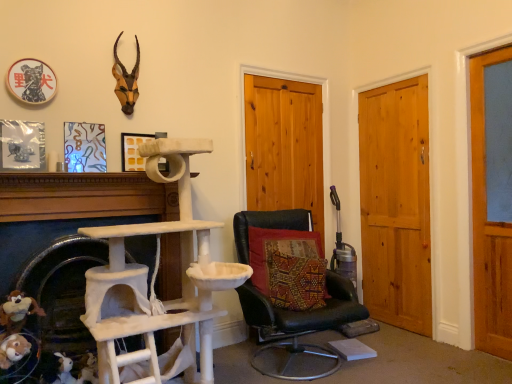
What is the approximate width of natural wood door at center right, the 2th door from the right?

natural wood door at center right, the 2th door from the right, is 3.34 inches in width.

Locate an element on the screen. wooden door at center, which is counted as the third door, starting from the right is located at coordinates (284, 146).

Describe the element at coordinates (288, 267) in the screenshot. I see `textured red cushion at center` at that location.

In order to face wooden door at right, the first door viewed from the right, should I rotate leftwards or rightwards?

To align with it, rotate right about 29.449°.

Locate an element on the screen. This screenshot has width=512, height=384. black leather chair at center is located at coordinates (300, 325).

Where is `natural wood door at center right, marked as the second door in a left-to-right arrangement`? This screenshot has width=512, height=384. natural wood door at center right, marked as the second door in a left-to-right arrangement is located at coordinates (396, 204).

Is brown plush toy at lower left, positioned as the first toy in top-to-bottom order, not close to wooden door at right, the first door viewed from the right?

Absolutely, brown plush toy at lower left, positioned as the first toy in top-to-bottom order, is distant from wooden door at right, the first door viewed from the right.

Considering the positions of point (13, 326) and point (490, 193), is point (13, 326) closer or farther from the camera than point (490, 193)?

Point (13, 326) appears to be closer to the viewer than point (490, 193).

From the image's perspective, between brown plush toy at lower left, positioned as the second toy in back-to-front order, and wooden door at right, the first door viewed from the right, which one is located above?

wooden door at right, the first door viewed from the right, is shown above in the image.

Looking at this image, is wooden door at center, which is counted as the third door, starting from the right, smaller than black leather chair at center?

Yes.

Considering the points (266, 132) and (331, 277), which point is in front, point (266, 132) or point (331, 277)?

The point (331, 277) is more forward.

Does wooden door at center, which is counted as the third door, starting from the right, touch black leather chair at center?

No, wooden door at center, which is counted as the third door, starting from the right, is not touching black leather chair at center.

What's the angular difference between wooden door at center, which is the first door from left to right, and black leather chair at center's facing directions?

The facing directions of wooden door at center, which is the first door from left to right, and black leather chair at center are 9.04 degrees apart.

This screenshot has height=384, width=512. Find the location of `pillow lying on the right of fuzzy fabric bunny at lower left, marked as the second toy in a left-to-right arrangement`. pillow lying on the right of fuzzy fabric bunny at lower left, marked as the second toy in a left-to-right arrangement is located at coordinates (288, 267).

Is point (88, 355) positioned after point (257, 275)?

No, it is not.

Is fuzzy fabric bunny at lower left, which is counted as the first toy, starting from the back, spatially inside textured red cushion at center, or outside of it?

fuzzy fabric bunny at lower left, which is counted as the first toy, starting from the back, is spatially situated outside textured red cushion at center.

Is fuzzy fabric bunny at lower left, which is counted as the first toy, starting from the back, positioned before textured red cushion at center?

Yes, fuzzy fabric bunny at lower left, which is counted as the first toy, starting from the back, is in front of textured red cushion at center.

Is wooden door at right, placed as the third door when sorted from left to right, surrounding matte yellow picture frame at center?

Definitely not — matte yellow picture frame at center is not inside wooden door at right, placed as the third door when sorted from left to right.

Is wooden door at right, placed as the third door when sorted from left to right, aimed at matte yellow picture frame at center?

Result: No, wooden door at right, placed as the third door when sorted from left to right, is not turned towards matte yellow picture frame at center.

Between wooden door at right, placed as the third door when sorted from left to right, and matte yellow picture frame at center, which one is positioned in front?

Positioned in front is wooden door at right, placed as the third door when sorted from left to right.

Is matte yellow picture frame at center shorter than brown plush toy at lower left, positioned as the second toy in back-to-front order?

Incorrect, the height of matte yellow picture frame at center does not fall short of that of brown plush toy at lower left, positioned as the second toy in back-to-front order.

Is matte yellow picture frame at center touching brown plush toy at lower left, positioned as the second toy in back-to-front order?

matte yellow picture frame at center and brown plush toy at lower left, positioned as the second toy in back-to-front order, are clearly separated.

Is matte yellow picture frame at center oriented towards brown plush toy at lower left, the 1th toy from the front?

No.

Is point (124, 140) closer or farther from the camera than point (17, 305)?

Point (124, 140).

Consider the image. Which is correct: textured red cushion at center is inside natural wood door at center right, marked as the second door in a left-to-right arrangement, or outside of it?

textured red cushion at center cannot be found inside natural wood door at center right, marked as the second door in a left-to-right arrangement.

Based on the photo, is textured red cushion at center not near natural wood door at center right, marked as the second door in a left-to-right arrangement?

Yes, textured red cushion at center and natural wood door at center right, marked as the second door in a left-to-right arrangement, are quite far apart.

Measure the distance from textured red cushion at center to natural wood door at center right, marked as the second door in a left-to-right arrangement.

1.04 meters.

Considering the sizes of objects textured red cushion at center and natural wood door at center right, the 2th door from the right, in the image provided, who is wider, textured red cushion at center or natural wood door at center right, the 2th door from the right,?

textured red cushion at center is wider.

Is point (16, 296) positioned after point (276, 86)?

That is False.

Is brown plush toy at lower left, the 1th toy from the front, looking in the opposite direction of wooden door at center, which is counted as the third door, starting from the right?

No, brown plush toy at lower left, the 1th toy from the front, is not facing the opposite direction of wooden door at center, which is counted as the third door, starting from the right.

Is brown plush toy at lower left, the 1th toy from the front, to the right of wooden door at center, which is counted as the third door, starting from the right, from the viewer's perspective?

Incorrect, brown plush toy at lower left, the 1th toy from the front, is not on the right side of wooden door at center, which is counted as the third door, starting from the right.

Where is `toy that is the 2nd object located in front of the wooden door at right, placed as the third door when sorted from left to right`? This screenshot has height=384, width=512. toy that is the 2nd object located in front of the wooden door at right, placed as the third door when sorted from left to right is located at coordinates (17, 311).

I want to click on door that is the 3rd object located behind the black leather chair at center, so click(x=284, y=146).

Estimate the real-world distances between objects in this image. Which object is closer to brown plush toy at lower left, positioned as the second toy in back-to-front order, black leather chair at center or wooden door at center, which is counted as the third door, starting from the right?

black leather chair at center lies closer to brown plush toy at lower left, positioned as the second toy in back-to-front order, than the other object.

Estimate the real-world distances between objects in this image. Which object is further from textured red cushion at center, wooden door at right, the first door viewed from the right, or fuzzy fabric bunny at lower left, placed as the second toy when sorted from top to bottom?

The object further to textured red cushion at center is wooden door at right, the first door viewed from the right.

Estimate the real-world distances between objects in this image. Which object is closer to wooden door at right, placed as the third door when sorted from left to right, textured red cushion at center or natural wood door at center right, the 2th door from the right?

Among the two, natural wood door at center right, the 2th door from the right, is located nearer to wooden door at right, placed as the third door when sorted from left to right.

Looking at the image, which one is located closer to antlered head at upper left, wooden door at right, placed as the third door when sorted from left to right, or wooden door at center, which is counted as the third door, starting from the right?

wooden door at center, which is counted as the third door, starting from the right, is closer to antlered head at upper left.

Looking at the image, which one is located closer to textured red cushion at center, wooden door at center, which is the first door from left to right, or natural wood door at center right, the 2th door from the right?

Based on the image, wooden door at center, which is the first door from left to right, appears to be nearer to textured red cushion at center.

Looking at the image, which one is located closer to fuzzy fabric bunny at lower left, marked as the second toy in a left-to-right arrangement, white fabric cat tree at left or matte yellow picture frame at center?

white fabric cat tree at left lies closer to fuzzy fabric bunny at lower left, marked as the second toy in a left-to-right arrangement, than the other object.

In the scene shown: Considering their positions, is textured red cushion at center positioned closer to white fabric cat tree at left than natural wood door at center right, marked as the second door in a left-to-right arrangement?

textured red cushion at center is closer to white fabric cat tree at left.

Considering their positions, is fuzzy fabric bunny at lower left, marked as the second toy in a left-to-right arrangement, positioned further to matte yellow picture frame at center than antlered head at upper left?

fuzzy fabric bunny at lower left, marked as the second toy in a left-to-right arrangement, lies further to matte yellow picture frame at center than the other object.

The height and width of the screenshot is (384, 512). I want to click on picture frame situated between brown plush toy at lower left, arranged as the second toy when viewed from the right, and wooden door at right, the first door viewed from the right, from left to right, so click(x=133, y=151).

Locate an element on the screen. This screenshot has height=384, width=512. picture frame located between white fabric cat tree at left and wooden door at right, placed as the third door when sorted from left to right, in the left-right direction is located at coordinates (133, 151).

The height and width of the screenshot is (384, 512). What are the coordinates of `toy located between white fabric cat tree at left and natural wood door at center right, marked as the second door in a left-to-right arrangement, in the left-right direction` in the screenshot? It's located at (89, 369).

You are a GUI agent. You are given a task and a screenshot of the screen. Output one action in this format:
    pyautogui.click(x=<x>, y=<y>)
    Task: Click on the animal between brown plush toy at lower left, the second toy when ordered from bottom to top, and wooden door at center, which is the first door from left to right
    The image size is (512, 384).
    Given the screenshot: What is the action you would take?
    pyautogui.click(x=126, y=80)